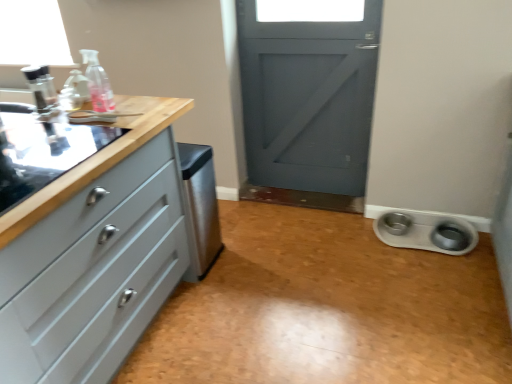
Find the location of a particular element. Image resolution: width=512 pixels, height=384 pixels. vacant space to the right of satin stainless steel dishwasher at center is located at coordinates (241, 257).